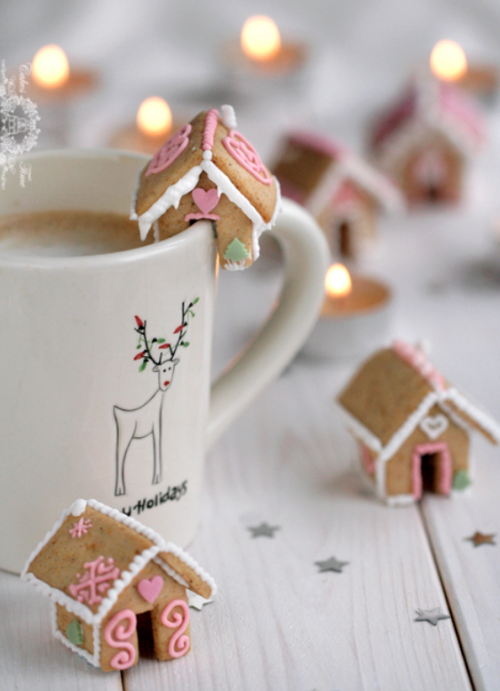
Find the location of `5 small gingerbread houses`. 5 small gingerbread houses is located at coordinates [446, 124], [330, 182], [215, 191], [155, 604], [410, 453].